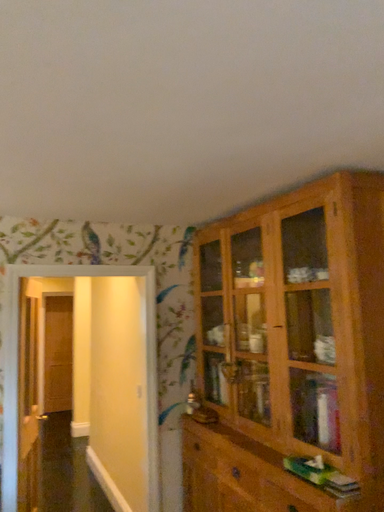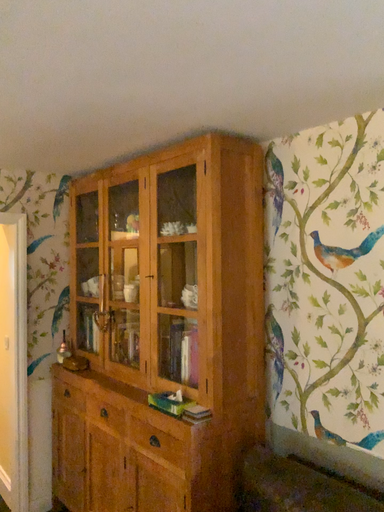
Question: Which way did the camera rotate in the video?

Choices:
 (A) rotated left
 (B) rotated right

Answer: (B)